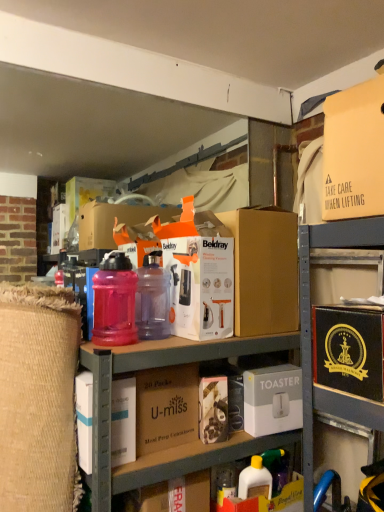
Question: From the image's perspective, does translucent pink plastic water bottle at center-left, placed as the 1th bottle when sorted from left to right, appear higher than yellow plastic bottle at lower center?

Choices:
 (A) yes
 (B) no

Answer: (A)

Question: Does translucent pink plastic water bottle at center-left, placed as the second bottle when sorted from right to left, lie in front of yellow plastic bottle at lower center?

Choices:
 (A) yes
 (B) no

Answer: (A)

Question: Does translucent pink plastic water bottle at center-left, placed as the second bottle when sorted from right to left, have a smaller size compared to yellow plastic bottle at lower center?

Choices:
 (A) yes
 (B) no

Answer: (B)

Question: From a real-world perspective, does translucent pink plastic water bottle at center-left, placed as the 1th bottle when sorted from left to right, sit lower than yellow plastic bottle at lower center?

Choices:
 (A) yes
 (B) no

Answer: (B)

Question: Is yellow plastic bottle at lower center surrounded by translucent pink plastic water bottle at center-left, placed as the 1th bottle when sorted from left to right?

Choices:
 (A) no
 (B) yes

Answer: (A)

Question: Can you confirm if translucent pink plastic water bottle at center-left, placed as the second bottle when sorted from right to left, is shorter than yellow plastic bottle at lower center?

Choices:
 (A) no
 (B) yes

Answer: (A)

Question: Considering the relative sizes of translucent pink plastic water bottle at center-left, placed as the 1th bottle when sorted from left to right, and matte plastic containers at center in the image provided, is translucent pink plastic water bottle at center-left, placed as the 1th bottle when sorted from left to right, thinner than matte plastic containers at center?

Choices:
 (A) yes
 (B) no

Answer: (A)

Question: Is translucent pink plastic water bottle at center-left, placed as the second bottle when sorted from right to left, far from matte plastic containers at center?

Choices:
 (A) yes
 (B) no

Answer: (B)

Question: From a real-world perspective, is translucent pink plastic water bottle at center-left, placed as the 1th bottle when sorted from left to right, on matte plastic containers at center?

Choices:
 (A) yes
 (B) no

Answer: (A)

Question: Could matte plastic containers at center be considered to be inside translucent pink plastic water bottle at center-left, placed as the 1th bottle when sorted from left to right?

Choices:
 (A) yes
 (B) no

Answer: (B)

Question: Considering the relative sizes of translucent pink plastic water bottle at center-left, placed as the second bottle when sorted from right to left, and matte plastic containers at center in the image provided, is translucent pink plastic water bottle at center-left, placed as the second bottle when sorted from right to left, bigger than matte plastic containers at center?

Choices:
 (A) no
 (B) yes

Answer: (A)

Question: Is translucent pink plastic water bottle at center-left, placed as the 1th bottle when sorted from left to right, at the right side of matte plastic containers at center?

Choices:
 (A) no
 (B) yes

Answer: (A)

Question: Is purple translucent bottle at center, which is the second bottle in left-to-right order, not inside white cardboard toaster at center, positioned as the 1th box in bottom-to-top order?

Choices:
 (A) no
 (B) yes

Answer: (B)